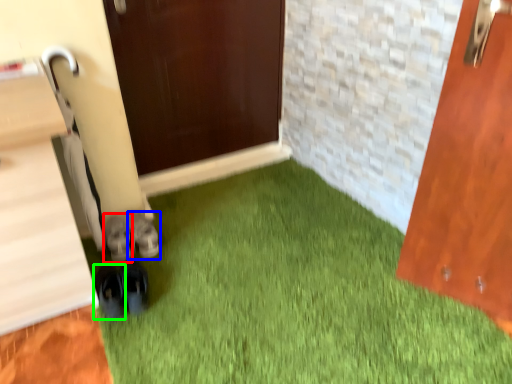
Question: Based on their relative distances, which object is farther from footwear (highlighted by a red box)? Choose from footwear (highlighted by a blue box) and footwear (highlighted by a green box).

Choices:
 (A) footwear
 (B) footwear

Answer: (B)